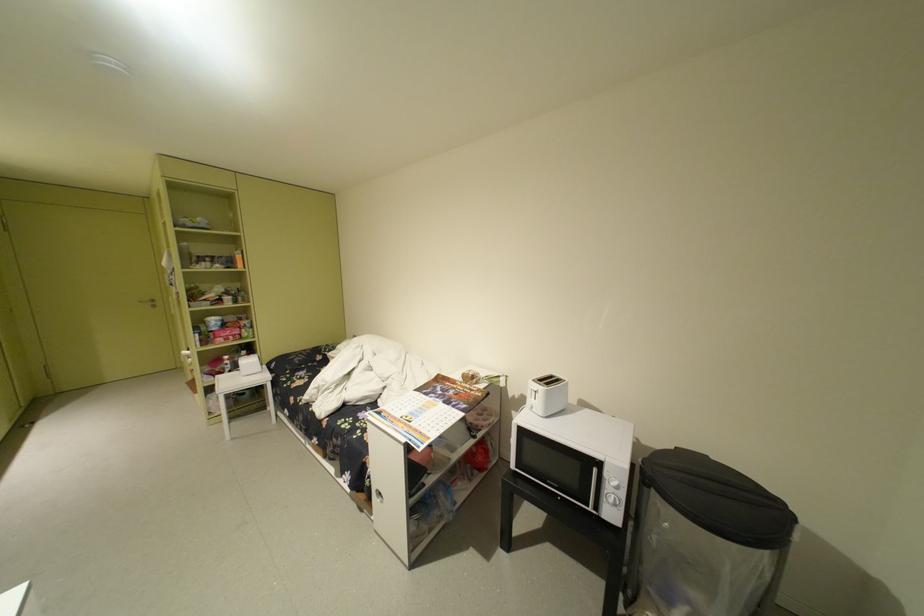
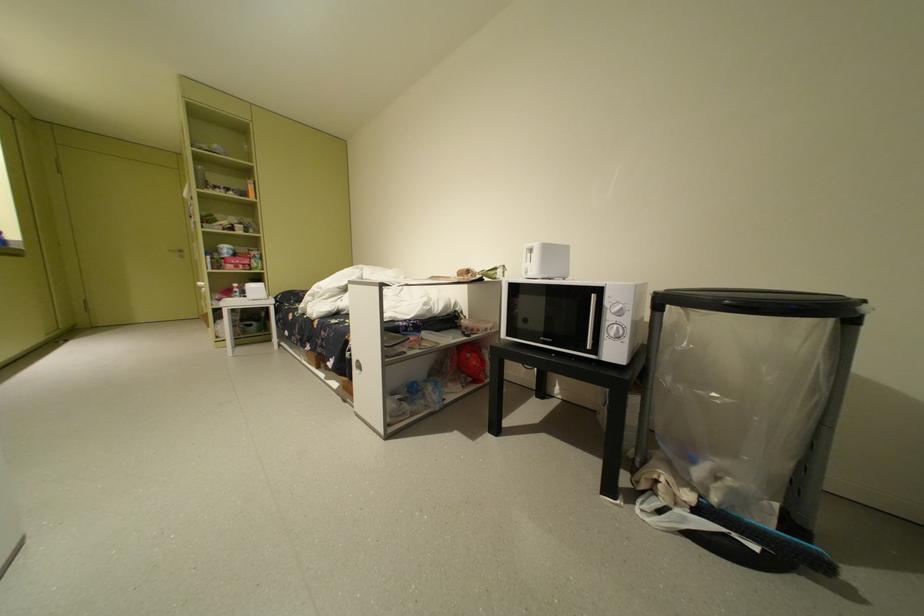
Question: The first image is from the beginning of the video and the second image is from the end. How did the camera likely rotate when shooting the video?

Choices:
 (A) Left
 (B) Right
 (C) Up
 (D) Down

Answer: (A)